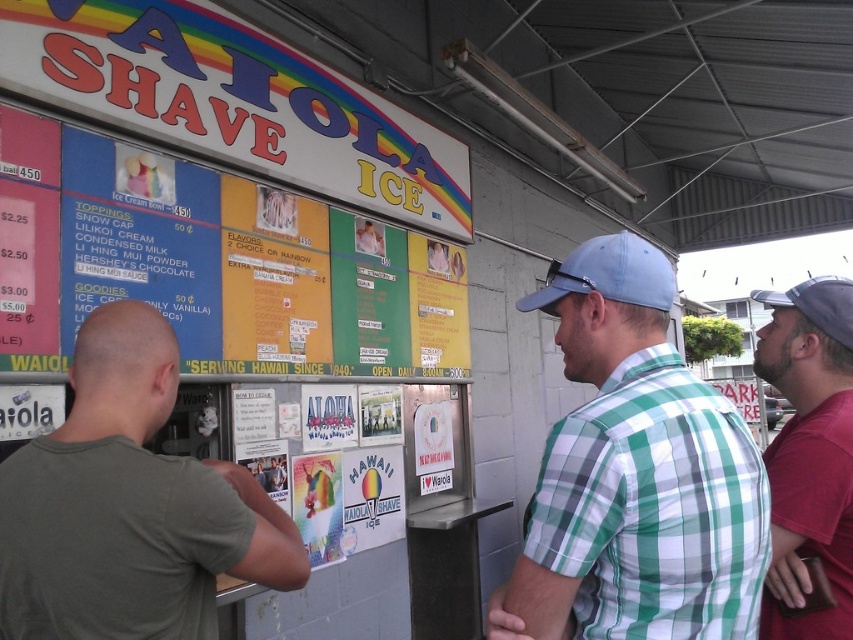
Based on the photo, can you confirm if green checkered shirt at center is taller than dark red shirt at right?

Indeed, green checkered shirt at center has a greater height compared to dark red shirt at right.

Which is in front, point (718, 593) or point (769, 452)?

Point (718, 593) is more forward.

Is point (625, 472) farther from viewer compared to point (808, 620)?

No, (625, 472) is closer to viewer.

In order to click on green checkered shirt at center in this screenshot , I will do `click(635, 474)`.

Does black fabric baseball cap at right come behind matte paper poster at center?

No, it is in front of matte paper poster at center.

Does black fabric baseball cap at right have a lesser width compared to matte paper poster at center?

In fact, black fabric baseball cap at right might be wider than matte paper poster at center.

Locate an element on the screen. Image resolution: width=853 pixels, height=640 pixels. black fabric baseball cap at right is located at coordinates (817, 305).

What are the coordinates of `black fabric baseball cap at right` in the screenshot? It's located at (817, 305).

Can you confirm if blue fabric baseball cap at center is positioned to the left of black fabric baseball cap at right?

Yes, blue fabric baseball cap at center is to the left of black fabric baseball cap at right.

Is blue fabric baseball cap at center to the right of black fabric baseball cap at right from the viewer's perspective?

No, blue fabric baseball cap at center is not to the right of black fabric baseball cap at right.

Where is `blue fabric baseball cap at center`? This screenshot has width=853, height=640. blue fabric baseball cap at center is located at coordinates (608, 275).